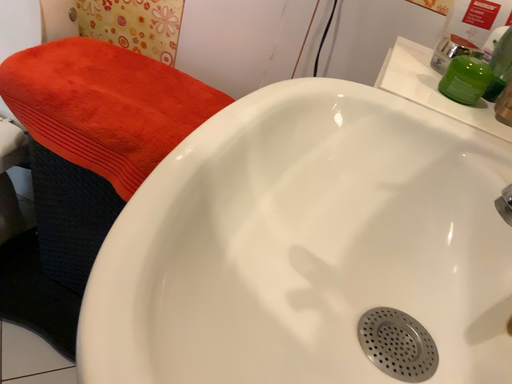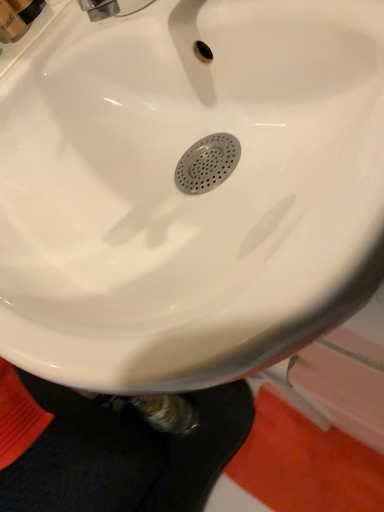
Question: How did the camera likely rotate when shooting the video?

Choices:
 (A) rotated downward
 (B) rotated upward

Answer: (B)